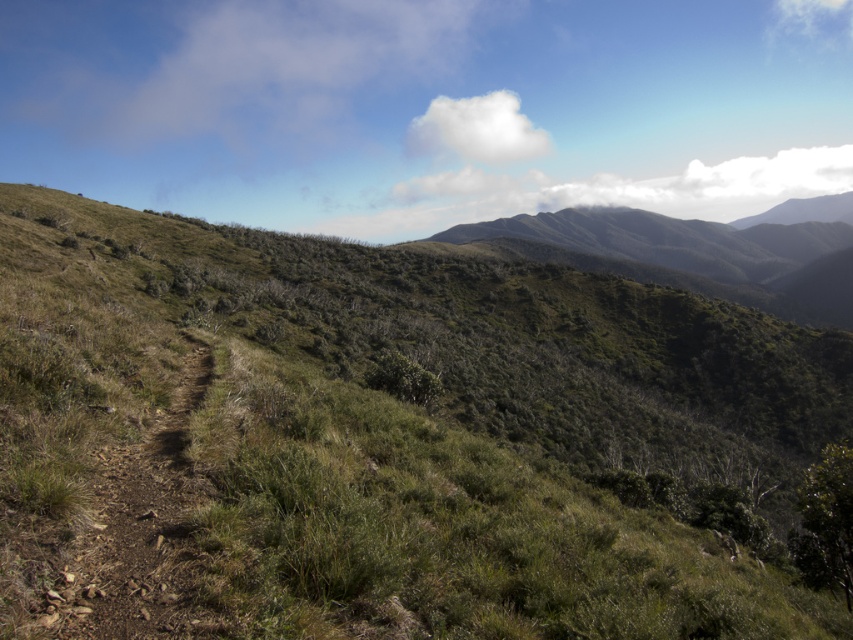
Question: Can you confirm if green grassy hillside at center is positioned above green grassy mountain at upper center?

Choices:
 (A) yes
 (B) no

Answer: (B)

Question: Which of the following is the closest to the observer?

Choices:
 (A) (584, 212)
 (B) (538, 582)

Answer: (B)

Question: Does green grassy hillside at center have a larger size compared to green grassy mountain at upper center?

Choices:
 (A) no
 (B) yes

Answer: (A)

Question: Is green grassy hillside at center thinner than green grassy mountain at upper center?

Choices:
 (A) no
 (B) yes

Answer: (B)